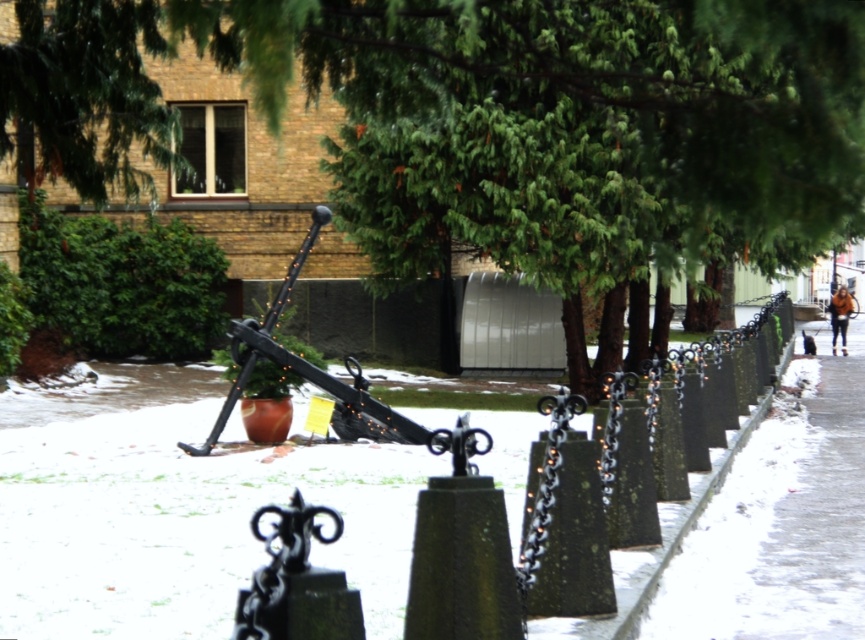
Question: Which point appears farthest from the camera in this image?

Choices:
 (A) (844, 394)
 (B) (840, 317)
 (C) (811, 234)

Answer: (B)

Question: Does green textured tree at center have a larger size compared to slick concrete sidewalk at lower right?

Choices:
 (A) yes
 (B) no

Answer: (A)

Question: Is green textured tree at center closer to camera compared to brown leather jacket at right?

Choices:
 (A) no
 (B) yes

Answer: (B)

Question: Which point appears farthest from the camera in this image?

Choices:
 (A) (844, 332)
 (B) (542, 230)

Answer: (A)

Question: Which point is closer to the camera taking this photo?

Choices:
 (A) (737, 515)
 (B) (844, 314)
 (C) (623, 76)

Answer: (A)

Question: Can you confirm if slick concrete sidewalk at lower right is positioned to the right of brown leather jacket at right?

Choices:
 (A) no
 (B) yes

Answer: (A)